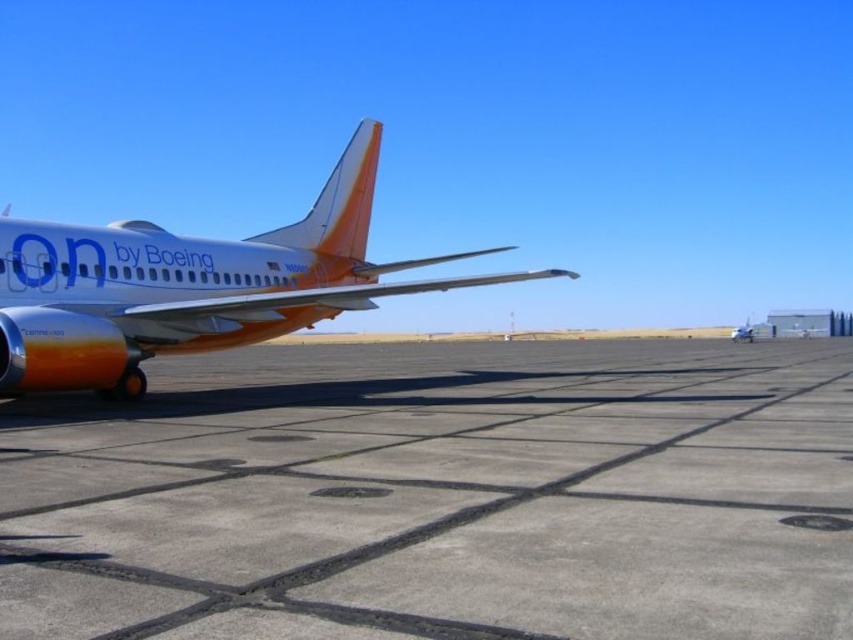
Question: Does concrete at center have a greater width compared to orange matte airplane at left?

Choices:
 (A) yes
 (B) no

Answer: (A)

Question: Which of the following is the farthest from the observer?

Choices:
 (A) (346, 458)
 (B) (268, 288)

Answer: (B)

Question: Can you confirm if concrete at center is wider than orange matte airplane at left?

Choices:
 (A) no
 (B) yes

Answer: (B)

Question: Does concrete at center have a greater width compared to orange matte airplane at left?

Choices:
 (A) yes
 (B) no

Answer: (A)

Question: Among these points, which one is farthest from the camera?

Choices:
 (A) (718, 346)
 (B) (143, 241)

Answer: (A)